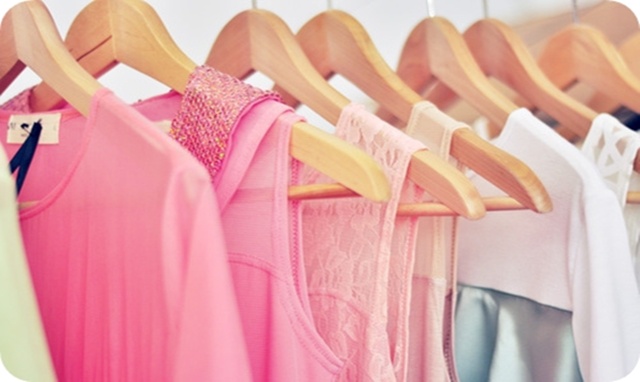
You are a GUI agent. You are given a task and a screenshot of the screen. Output one action in this format:
    pyautogui.click(x=<x>, y=<y>)
    Task: Click on the hangers
    This screenshot has width=640, height=382.
    Given the screenshot: What is the action you would take?
    pyautogui.click(x=50, y=50), pyautogui.click(x=109, y=42), pyautogui.click(x=262, y=43), pyautogui.click(x=346, y=48), pyautogui.click(x=450, y=53), pyautogui.click(x=496, y=56), pyautogui.click(x=589, y=67)